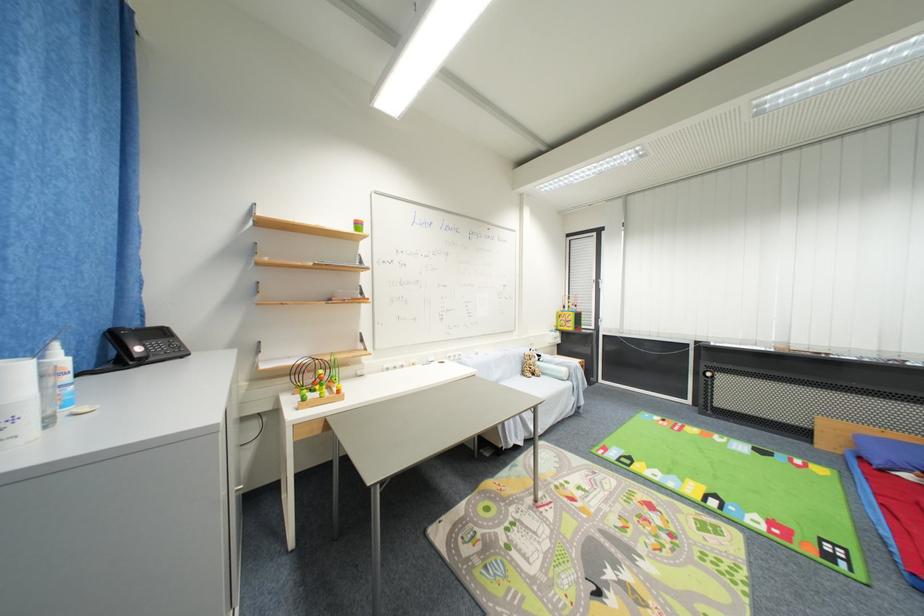
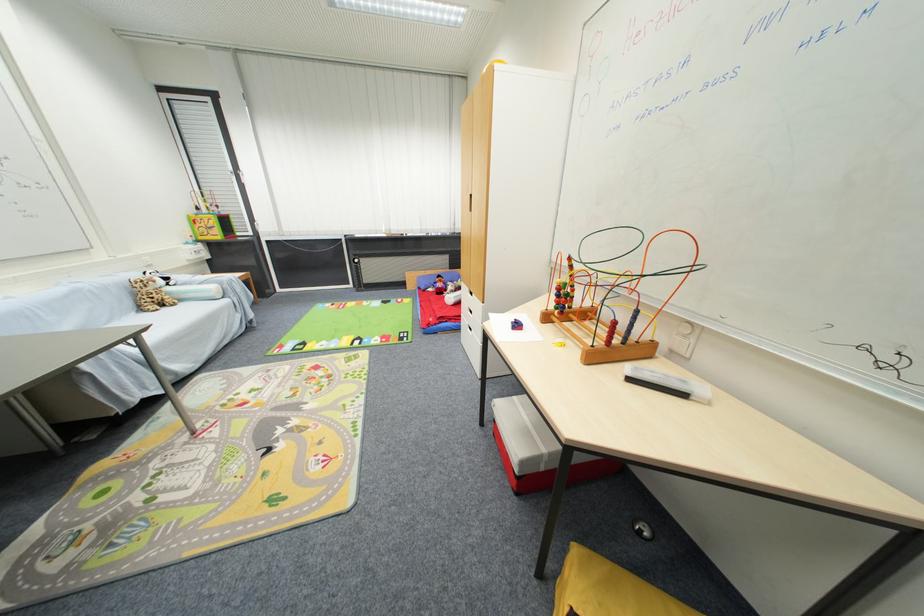
Where in the second image is the point corresponding to (569,371) from the first image?

(217, 290)